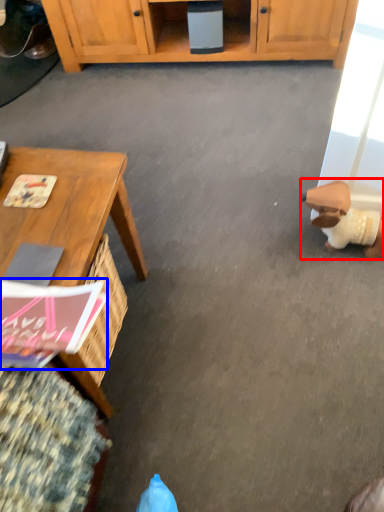
Question: Which object is closer to the camera taking this photo, toy (highlighted by a red box) or magazine (highlighted by a blue box)?

Choices:
 (A) toy
 (B) magazine

Answer: (B)